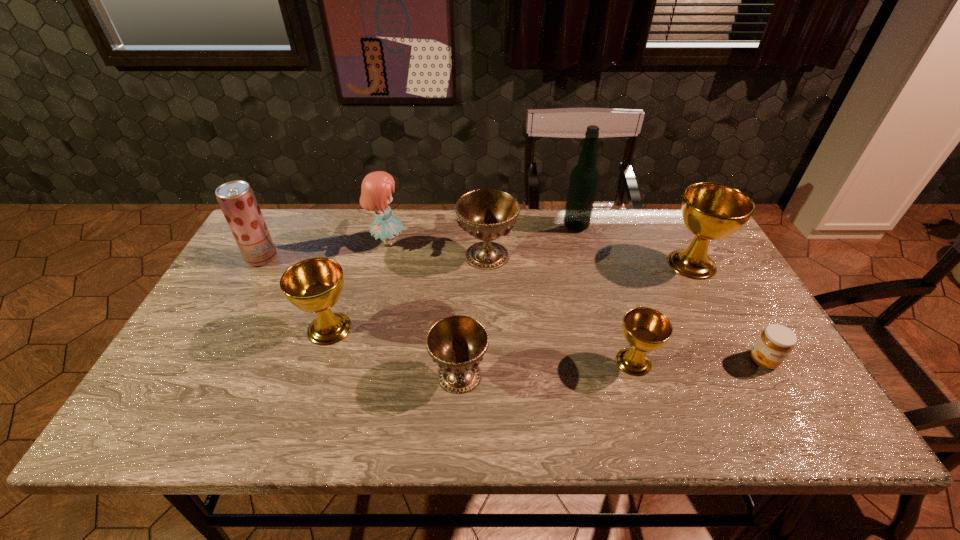
At what (x,y) coordinates should I click in order to perform the action: click on alcohol. Please return your answer as a coordinate pair (x, y). This screenshot has height=540, width=960. Looking at the image, I should click on (584, 177).

Find the location of `green alcohol`. green alcohol is located at coordinates (584, 177).

Where is `strawberry fruit juice`? strawberry fruit juice is located at coordinates (236, 199).

Where is `the leftmost object`? This screenshot has width=960, height=540. the leftmost object is located at coordinates (236, 199).

Locate an element on the screen. Image resolution: width=960 pixels, height=540 pixels. doll is located at coordinates (376, 190).

Identify the location of the rightmost gold chalice. The height and width of the screenshot is (540, 960). (711, 211).

I want to click on the farthest gold chalice, so click(711, 211).

The image size is (960, 540). Identify the location of the bigger red chalice. (487, 214).

At what (x,y) coordinates should I click in order to perform the action: click on the second biggest gold chalice. Please return your answer as a coordinate pair (x, y). The image size is (960, 540). Looking at the image, I should click on click(314, 285).

Locate an element on the screen. This screenshot has height=540, width=960. the leftmost gold chalice is located at coordinates (314, 285).